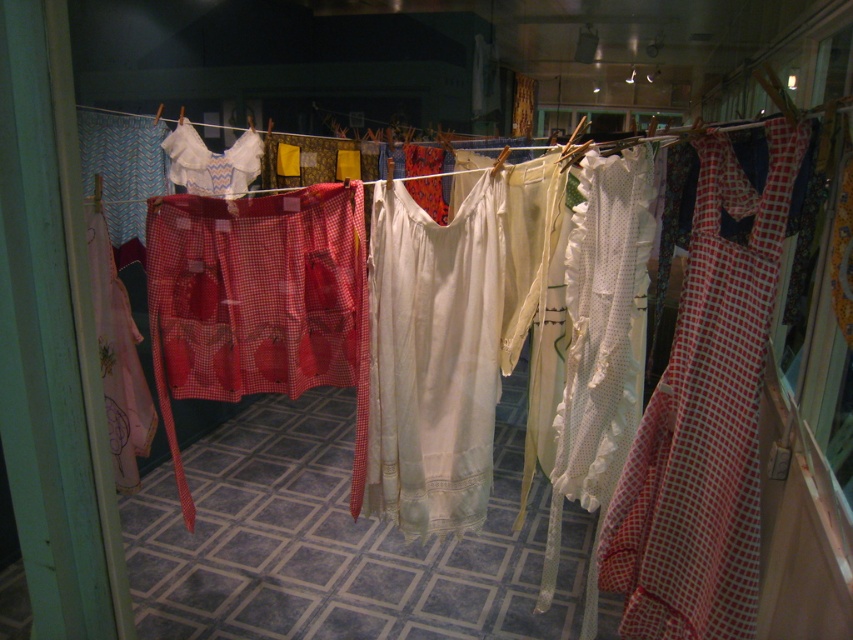
Can you confirm if red checkered dress at right is shorter than white cotton dress at center?

Yes.

I want to click on red checkered dress at right, so click(705, 417).

Describe the element at coordinates (705, 417) in the screenshot. I see `red checkered dress at right` at that location.

This screenshot has height=640, width=853. What do you see at coordinates (705, 417) in the screenshot?
I see `red checkered dress at right` at bounding box center [705, 417].

The height and width of the screenshot is (640, 853). What are the coordinates of `red checkered dress at right` in the screenshot? It's located at (705, 417).

Can you confirm if white cotton dress at center is smaller than white lace blouse at center?

Incorrect, white cotton dress at center is not smaller in size than white lace blouse at center.

Where is `white cotton dress at center`? This screenshot has width=853, height=640. white cotton dress at center is located at coordinates (433, 356).

Locate an element on the screen. white cotton dress at center is located at coordinates (433, 356).